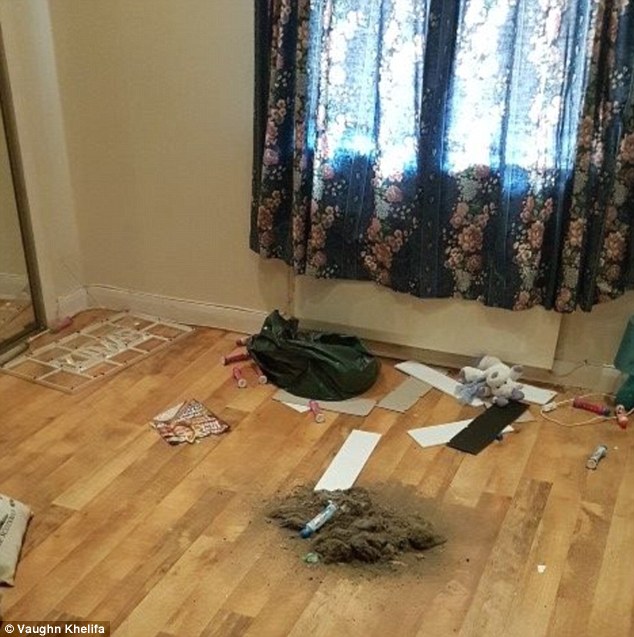
Where is `wall`? This screenshot has height=637, width=634. wall is located at coordinates (188, 246), (592, 327).